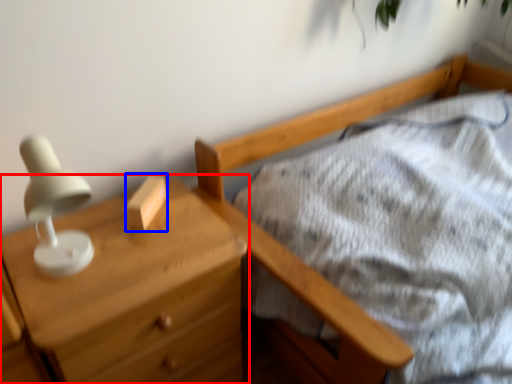
Question: Which object appears farthest to the camera in this image, chest of drawers (highlighted by a red box) or block (highlighted by a blue box)?

Choices:
 (A) chest of drawers
 (B) block

Answer: (B)